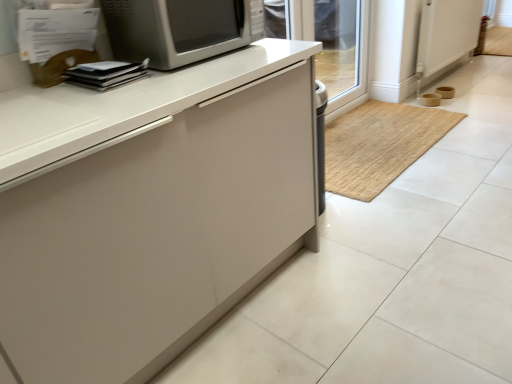
Question: In the image, is white plastic screen door at upper right positioned in front of or behind transparent glass door at upper right?

Choices:
 (A) behind
 (B) front

Answer: (A)

Question: Is white plastic screen door at upper right spatially inside transparent glass door at upper right, or outside of it?

Choices:
 (A) inside
 (B) outside

Answer: (B)

Question: Estimate the real-world distances between objects in this image. Which object is farther from the transparent glass door at upper right?

Choices:
 (A) bamboo mat at center
 (B) matte white cabinet at center
 (C) white plastic screen door at upper right
 (D) satin silver microwave at upper center

Answer: (B)

Question: Estimate the real-world distances between objects in this image. Which object is farther from the transparent glass door at upper right?

Choices:
 (A) matte white cabinet at center
 (B) satin silver microwave at upper center
 (C) bamboo mat at center
 (D) white plastic screen door at upper right

Answer: (A)